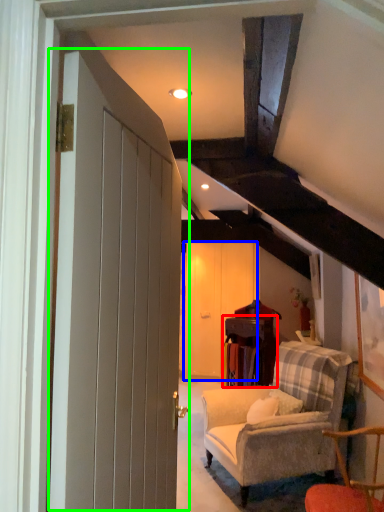
Question: Which is nearer to the table (highlighted by a red box)? barn door (highlighted by a blue box) or door (highlighted by a green box).

Choices:
 (A) barn door
 (B) door

Answer: (A)